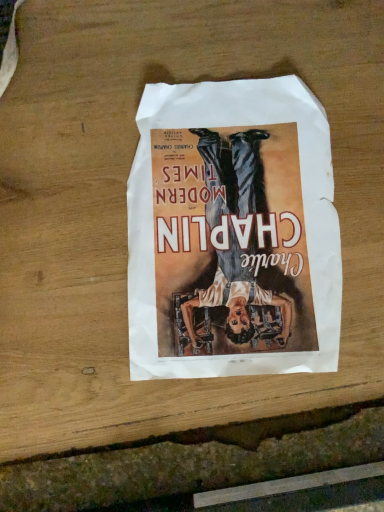
What do you see at coordinates (233, 232) in the screenshot?
I see `matte paper poster at center` at bounding box center [233, 232].

The image size is (384, 512). I want to click on matte paper poster at center, so click(233, 232).

Image resolution: width=384 pixels, height=512 pixels. Find the location of `matte paper poster at center`. matte paper poster at center is located at coordinates point(233,232).